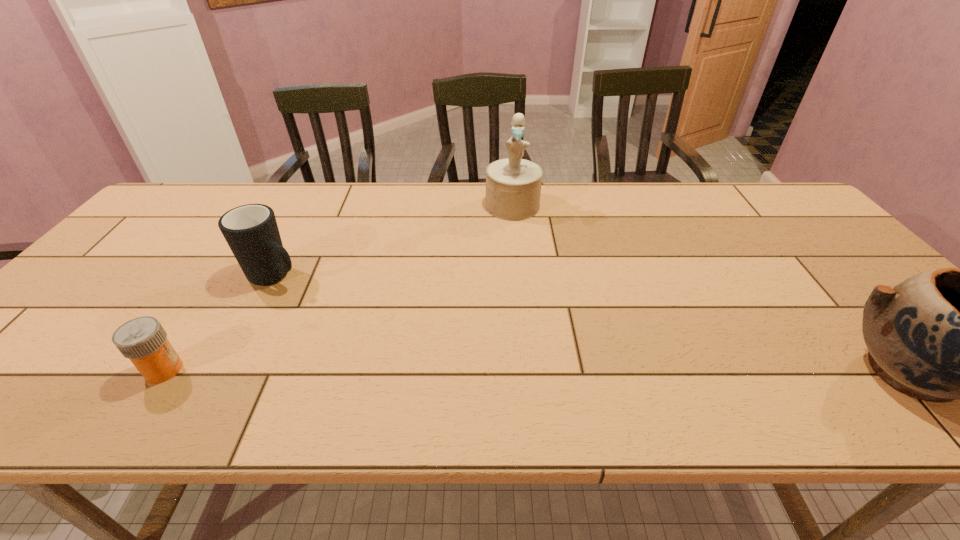
This screenshot has height=540, width=960. What are the coordinates of `free spot on the desktop that is between the medicine and the third shortest object and is positioned on the side of the second shortest object with the handle` in the screenshot? It's located at (461, 372).

I want to click on vacant spot on the desktop that is between the leftmost object and the pottery and is positioned at the beak of the farthest object, so click(x=514, y=372).